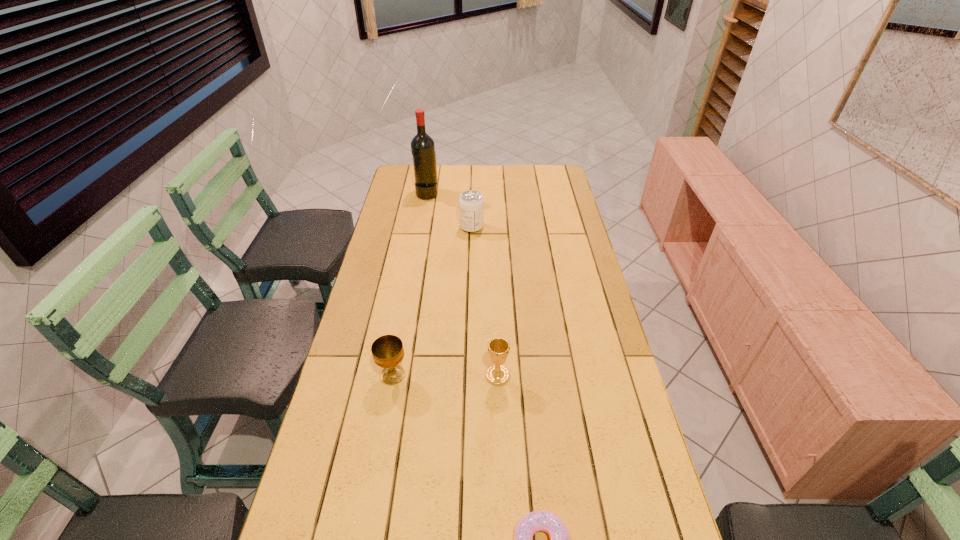
Locate an element on the screen. the farthest object is located at coordinates coord(422,145).

Find the location of a particular element. The image size is (960, 540). the tallest object is located at coordinates (422, 145).

Where is `the fourth nearest object`? the fourth nearest object is located at coordinates (471, 203).

At what (x,y) coordinates should I click in order to perform the action: click on the third object from left to right. Please return your answer as a coordinate pair (x, y). Looking at the image, I should click on (471, 203).

This screenshot has height=540, width=960. I want to click on the right chalice, so click(498, 348).

This screenshot has height=540, width=960. Find the location of `the left chalice`. the left chalice is located at coordinates (387, 350).

The width and height of the screenshot is (960, 540). In order to click on vacant area located 0.090m on the back of the wine bottle in this screenshot , I will do `click(430, 178)`.

I want to click on free region located 0.370m on the right of the second farthest object, so click(575, 227).

This screenshot has height=540, width=960. Identify the location of vacant position located on the right of the right chalice. (566, 376).

Where is `free space located on the front of the left chalice`? free space located on the front of the left chalice is located at coordinates (385, 420).